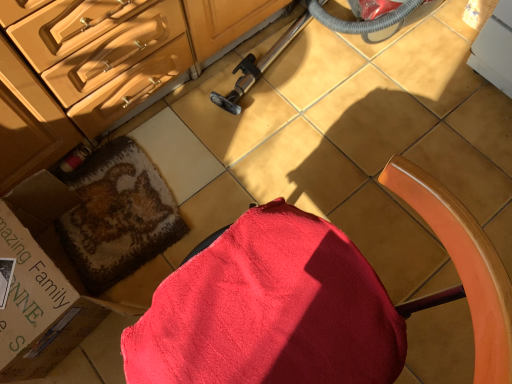
Question: Can you confirm if cardboard box at lower left is positioned to the right of red fabric chair at center?

Choices:
 (A) yes
 (B) no

Answer: (B)

Question: Does cardboard box at lower left appear on the left side of red fabric chair at center?

Choices:
 (A) yes
 (B) no

Answer: (A)

Question: Considering the relative positions of cardboard box at lower left and red fabric chair at center in the image provided, is cardboard box at lower left behind red fabric chair at center?

Choices:
 (A) yes
 (B) no

Answer: (A)

Question: Would you say cardboard box at lower left contains red fabric chair at center?

Choices:
 (A) yes
 (B) no

Answer: (B)

Question: Does cardboard box at lower left have a larger size compared to red fabric chair at center?

Choices:
 (A) yes
 (B) no

Answer: (B)

Question: Is red cotton bath towel at lower left situated inside cardboard box at lower left or outside?

Choices:
 (A) outside
 (B) inside

Answer: (A)

Question: Considering the positions of red cotton bath towel at lower left and cardboard box at lower left in the image, is red cotton bath towel at lower left bigger or smaller than cardboard box at lower left?

Choices:
 (A) small
 (B) big

Answer: (A)

Question: Visually, is red cotton bath towel at lower left positioned to the left or to the right of cardboard box at lower left?

Choices:
 (A) left
 (B) right

Answer: (B)

Question: In terms of width, does red cotton bath towel at lower left look wider or thinner when compared to cardboard box at lower left?

Choices:
 (A) thin
 (B) wide

Answer: (B)

Question: Based on their sizes in the image, would you say matte wood cabinetry at upper left is bigger or smaller than cardboard box at lower left?

Choices:
 (A) big
 (B) small

Answer: (A)

Question: Considering the positions of point (165, 33) and point (174, 231), is point (165, 33) closer or farther from the camera than point (174, 231)?

Choices:
 (A) closer
 (B) farther

Answer: (A)

Question: In the image, is matte wood cabinetry at upper left positioned in front of or behind cardboard box at lower left?

Choices:
 (A) front
 (B) behind

Answer: (A)

Question: Considering the positions of matte wood cabinetry at upper left and cardboard box at lower left in the image, is matte wood cabinetry at upper left wider or thinner than cardboard box at lower left?

Choices:
 (A) thin
 (B) wide

Answer: (B)

Question: In the image, is red fabric chair at center on the left side or the right side of cardboard box at lower left?

Choices:
 (A) left
 (B) right

Answer: (B)

Question: Is red fabric chair at center situated inside cardboard box at lower left or outside?

Choices:
 (A) inside
 (B) outside

Answer: (B)